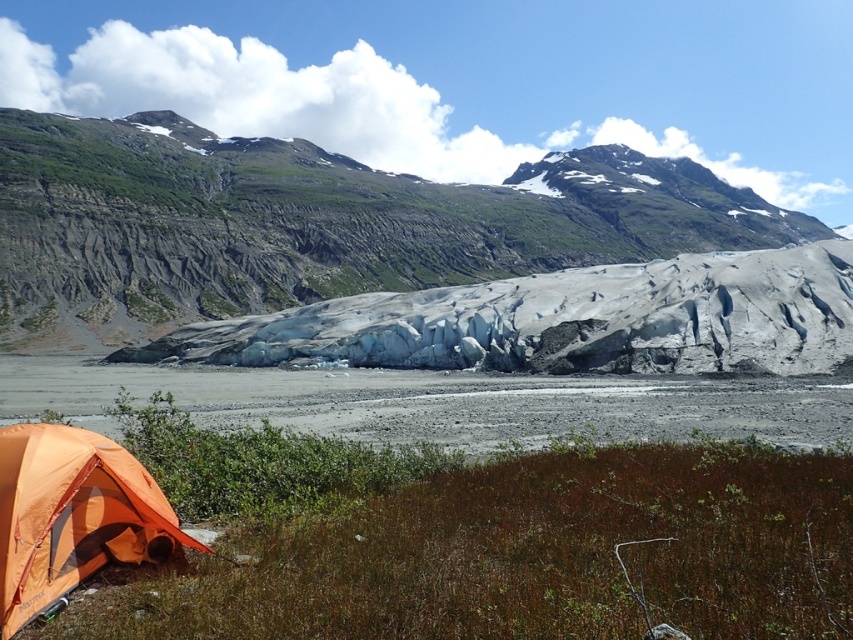
Does point (65, 204) lie in front of point (277, 312)?

No, it is behind (277, 312).

Does gray rocky mountain at center have a lesser width compared to gray/rocky glacier at center?

Incorrect, gray rocky mountain at center's width is not less than gray/rocky glacier at center's.

Which is behind, point (634, 259) or point (727, 269)?

The point (634, 259) is more distant.

Locate an element on the screen. This screenshot has width=853, height=640. gray rocky mountain at center is located at coordinates (311, 224).

Is gray/rocky glacier at center smaller than orange fabric tent at lower left?

Actually, gray/rocky glacier at center might be larger than orange fabric tent at lower left.

Is gray/rocky glacier at center to the left of orange fabric tent at lower left from the viewer's perspective?

No, gray/rocky glacier at center is not to the left of orange fabric tent at lower left.

You are a GUI agent. You are given a task and a screenshot of the screen. Output one action in this format:
    pyautogui.click(x=<x>, y=<y>)
    Task: Click on the gray/rocky glacier at center
    The image size is (853, 640).
    Given the screenshot: What is the action you would take?
    pyautogui.click(x=566, y=321)

Measure the distance between gray rocky mountain at center and camera.

135.21 meters

This screenshot has height=640, width=853. What are the coordinates of `gray rocky mountain at center` in the screenshot? It's located at [311, 224].

This screenshot has width=853, height=640. Describe the element at coordinates (311, 224) in the screenshot. I see `gray rocky mountain at center` at that location.

At what (x,y) coordinates should I click in order to perform the action: click on gray rocky mountain at center. Please return your answer as a coordinate pair (x, y). The width and height of the screenshot is (853, 640). Looking at the image, I should click on (311, 224).